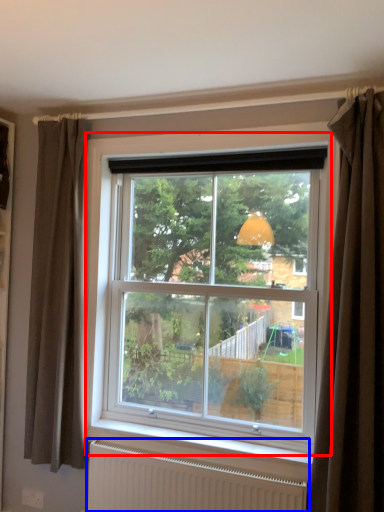
Question: Among these objects, which one is nearest to the camera, window (highlighted by a red box) or radiator (highlighted by a blue box)?

Choices:
 (A) window
 (B) radiator

Answer: (B)